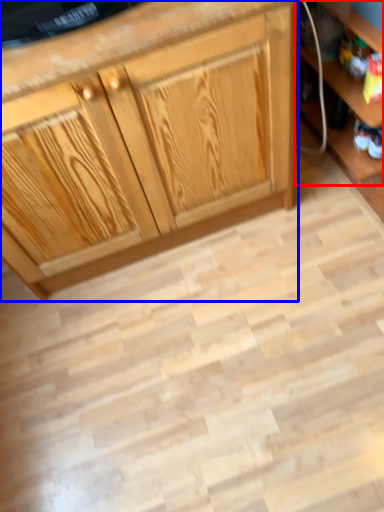
Question: Among these objects, which one is nearest to the camera, shelf (highlighted by a red box) or cabinetry (highlighted by a blue box)?

Choices:
 (A) shelf
 (B) cabinetry

Answer: (B)